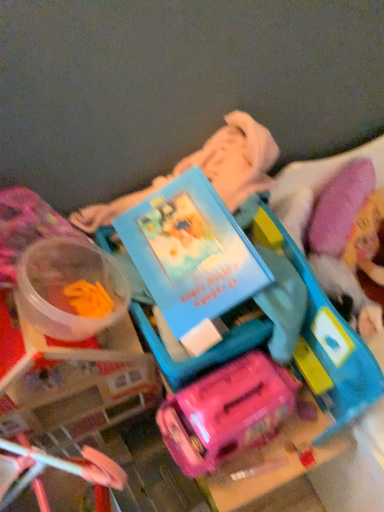
Question: Is matte blue book at center oriented away from matte plastic suitcase at center, the first toy in the right-to-left sequence?

Choices:
 (A) no
 (B) yes

Answer: (A)

Question: Does matte blue book at center touch matte plastic suitcase at center, the first toy in the right-to-left sequence?

Choices:
 (A) yes
 (B) no

Answer: (B)

Question: Is matte blue book at center taller than matte plastic suitcase at center, the first toy in the right-to-left sequence?

Choices:
 (A) no
 (B) yes

Answer: (A)

Question: Is matte blue book at center facing towards matte plastic suitcase at center, the first toy in the right-to-left sequence?

Choices:
 (A) no
 (B) yes

Answer: (A)

Question: From the image's perspective, would you say matte blue book at center is shown under matte plastic suitcase at center, which is the second toy from left to right?

Choices:
 (A) no
 (B) yes

Answer: (A)

Question: Does matte blue book at center have a lesser width compared to matte plastic suitcase at center, which is the second toy from left to right?

Choices:
 (A) no
 (B) yes

Answer: (B)

Question: Does translucent plastic container at left, which is counted as the 2th toy, starting from the right, have a greater height compared to matte plastic suitcase at center, the first toy in the right-to-left sequence?

Choices:
 (A) no
 (B) yes

Answer: (A)

Question: From a real-world perspective, is translucent plastic container at left, arranged as the 1th toy when viewed from the left, located higher than matte plastic suitcase at center, the first toy in the right-to-left sequence?

Choices:
 (A) yes
 (B) no

Answer: (A)

Question: Can you confirm if translucent plastic container at left, arranged as the 1th toy when viewed from the left, is positioned to the right of matte plastic suitcase at center, the first toy in the right-to-left sequence?

Choices:
 (A) yes
 (B) no

Answer: (B)

Question: From a real-world perspective, is translucent plastic container at left, arranged as the 1th toy when viewed from the left, below matte plastic suitcase at center, the first toy in the right-to-left sequence?

Choices:
 (A) yes
 (B) no

Answer: (B)

Question: Does translucent plastic container at left, which is counted as the 2th toy, starting from the right, turn towards matte plastic suitcase at center, which is the second toy from left to right?

Choices:
 (A) yes
 (B) no

Answer: (B)

Question: Would you say matte plastic suitcase at center, the first toy in the right-to-left sequence, is part of translucent plastic container at left, arranged as the 1th toy when viewed from the left,'s contents?

Choices:
 (A) yes
 (B) no

Answer: (B)

Question: Considering the relative positions of matte blue book at center and translucent plastic container at left, arranged as the 1th toy when viewed from the left, in the image provided, is matte blue book at center to the left of translucent plastic container at left, arranged as the 1th toy when viewed from the left, from the viewer's perspective?

Choices:
 (A) no
 (B) yes

Answer: (A)